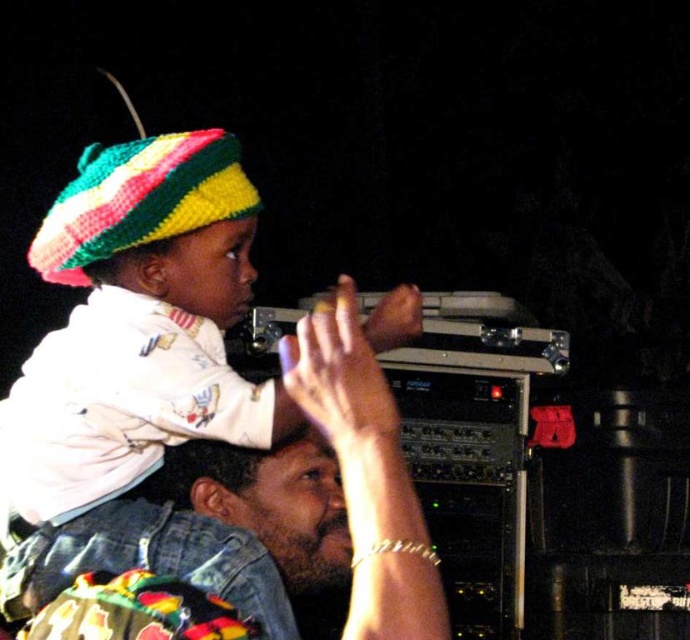
Is jeans at center shorter than knitted multicolored hat at upper left?

In fact, jeans at center may be taller than knitted multicolored hat at upper left.

Locate an element on the screen. This screenshot has width=690, height=640. jeans at center is located at coordinates (366, 474).

Who is higher up, gold bracelet at upper center or knitted multicolored hat at upper left?

knitted multicolored hat at upper left

Does gold bracelet at upper center appear over knitted multicolored hat at upper left?

Actually, gold bracelet at upper center is below knitted multicolored hat at upper left.

Is point (364, 438) closer to camera compared to point (99, 216)?

Yes.

Where is `gold bracelet at upper center`? This screenshot has width=690, height=640. gold bracelet at upper center is located at coordinates (366, 472).

Does jeans at center have a greater height compared to gold bracelet at upper center?

Yes, jeans at center is taller than gold bracelet at upper center.

Is jeans at center shorter than gold bracelet at upper center?

In fact, jeans at center may be taller than gold bracelet at upper center.

Between point (170, 561) and point (339, 289), which one is positioned behind?

The point (170, 561) is more distant.

Where is `jeans at center`? jeans at center is located at coordinates pos(366,474).